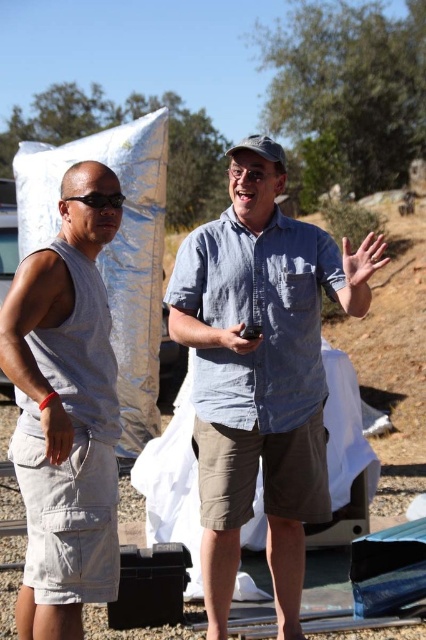
Question: Among these points, which one is farthest from the camera?

Choices:
 (A) (74, 424)
 (B) (261, 262)

Answer: (B)

Question: Which of the following is the closest to the observer?

Choices:
 (A) matte black phone at center
 (B) gray fabric wristband at lower left
 (C) smooth skin hand at center
 (D) gray cotton tank top at left

Answer: (D)

Question: Is gray cotton tank top at left to the right of gray fabric wristband at lower left from the viewer's perspective?

Choices:
 (A) no
 (B) yes

Answer: (A)

Question: Can you confirm if gray fabric wristband at lower left is positioned to the right of matte black phone at center?

Choices:
 (A) no
 (B) yes

Answer: (A)

Question: Can you confirm if blue linen shirt at center is positioned to the left of gray cotton tank top at left?

Choices:
 (A) yes
 (B) no

Answer: (B)

Question: Which of the following is the closest to the observer?

Choices:
 (A) (258, 337)
 (B) (377, 260)
 (C) (264, 285)
 (D) (115, 573)

Answer: (D)